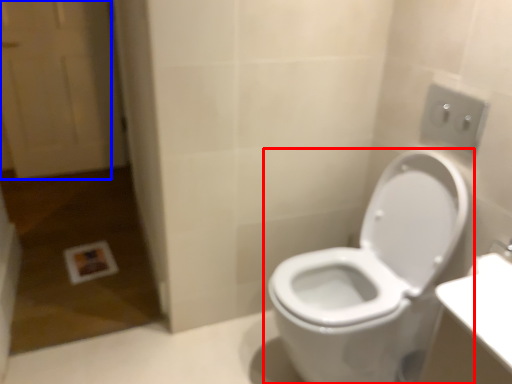
Question: Among these objects, which one is nearest to the camera, toilet (highlighted by a red box) or screen door (highlighted by a blue box)?

Choices:
 (A) toilet
 (B) screen door

Answer: (A)